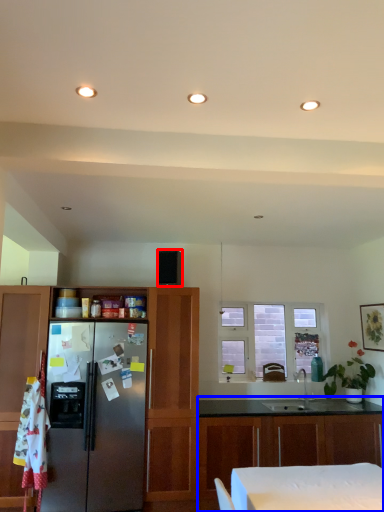
Question: Which object is further to the camera taking this photo, appliance (highlighted by a red box) or cabinetry (highlighted by a blue box)?

Choices:
 (A) appliance
 (B) cabinetry

Answer: (A)